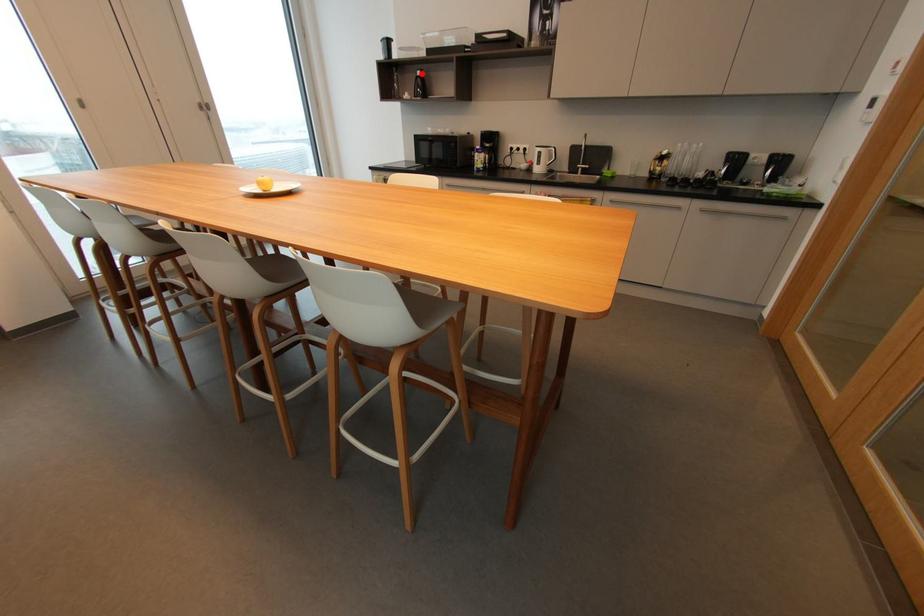
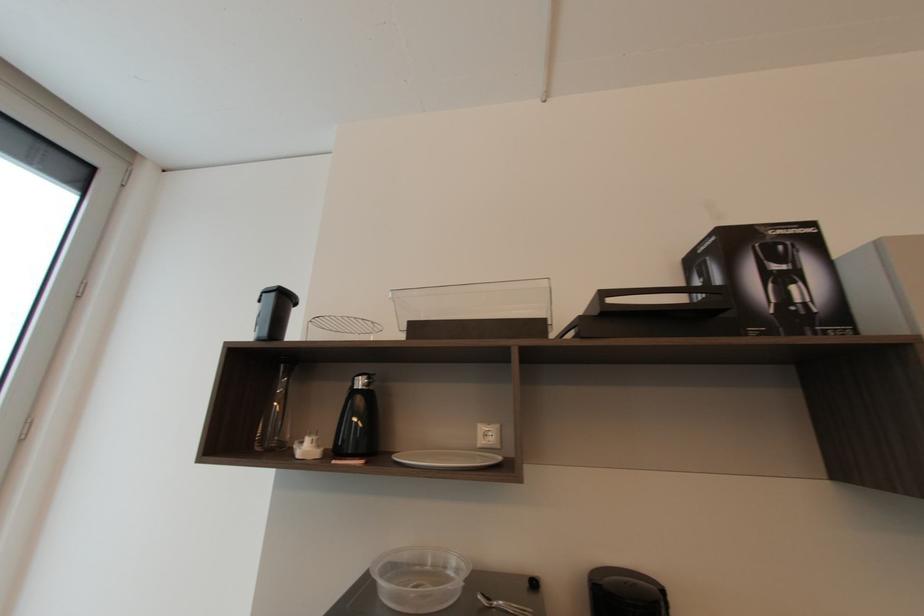
Question: I am providing you with two images of the same scene from different viewpoints. A red point is shown in image1. For the corresponding object point in image2, is it positioned nearer or farther from the camera?

Choices:
 (A) Nearer
 (B) Farther

Answer: (B)